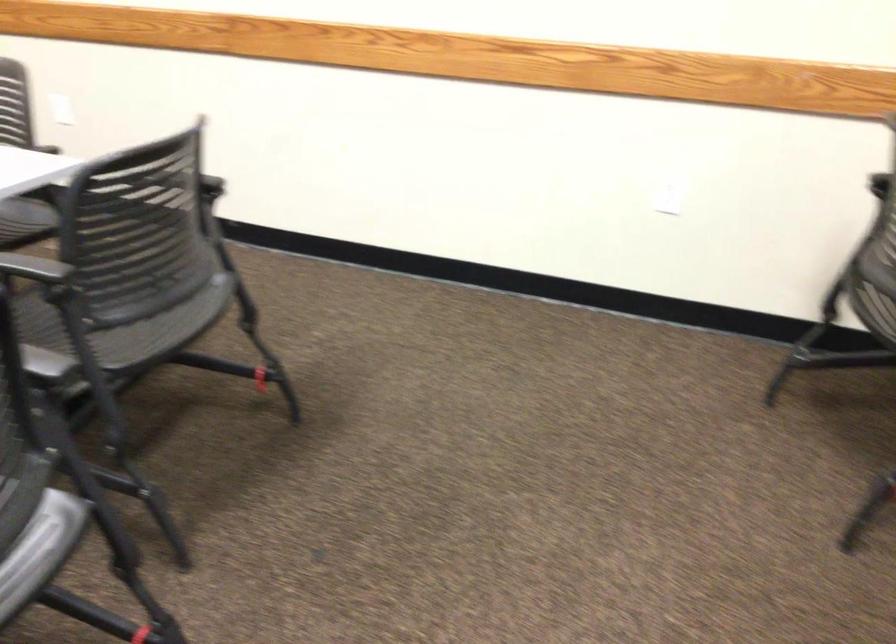
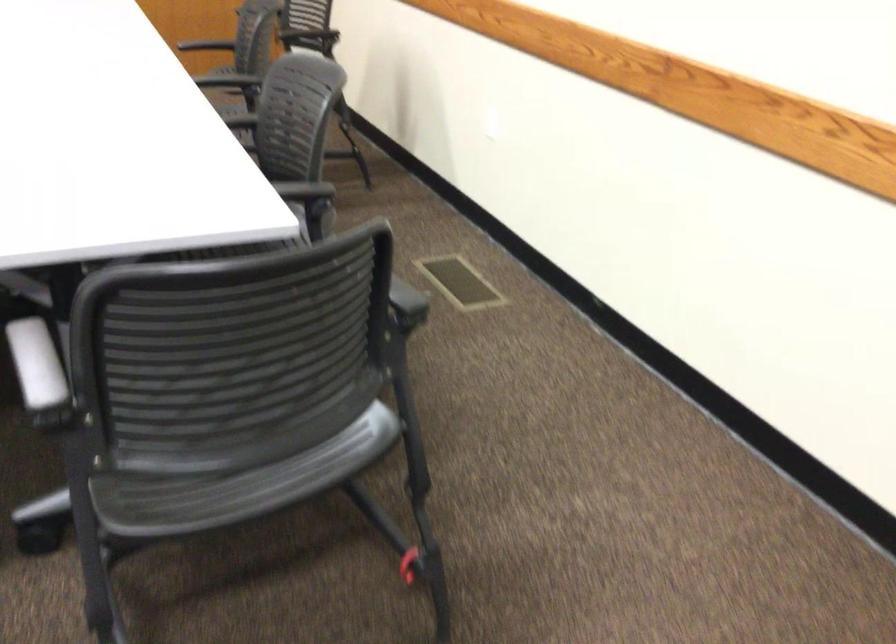
Question: How did the camera likely rotate?

Choices:
 (A) Left
 (B) Right
 (C) Up
 (D) Down

Answer: (A)